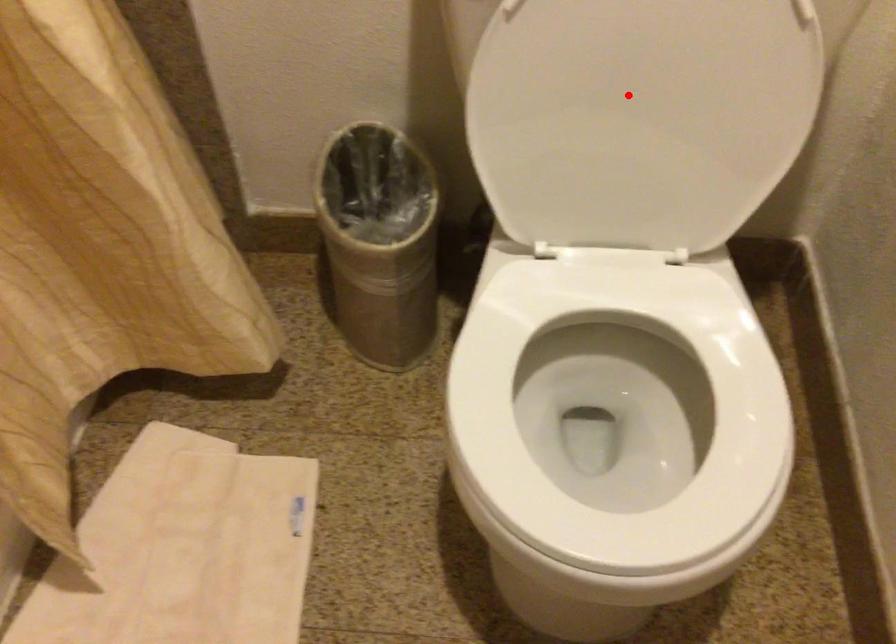
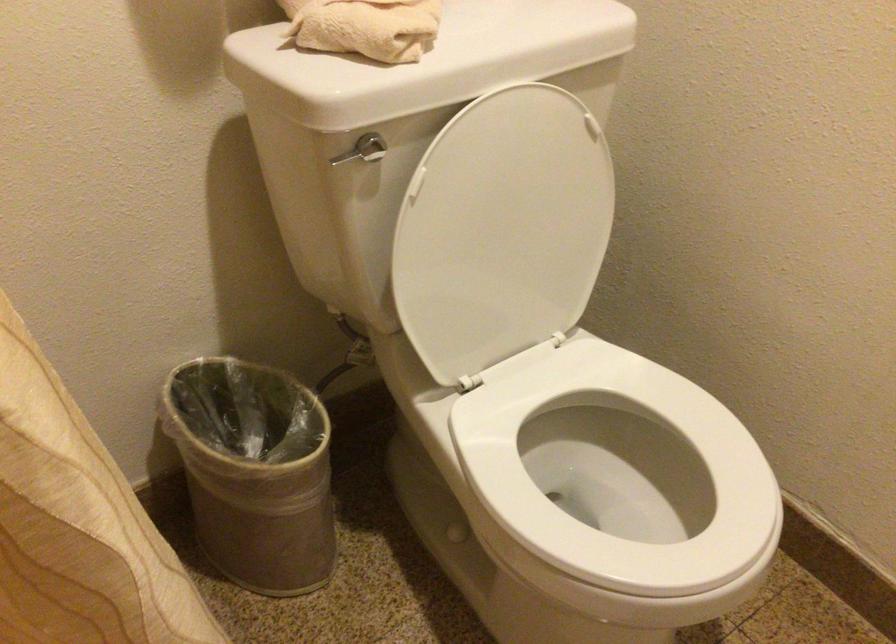
Question: I am providing you with two images of the same scene from different viewpoints. Given a red point in image1, look at the same physical point in image2. Is it:

Choices:
 (A) Closer to the viewpoint
 (B) Farther from the viewpoint

Answer: (B)